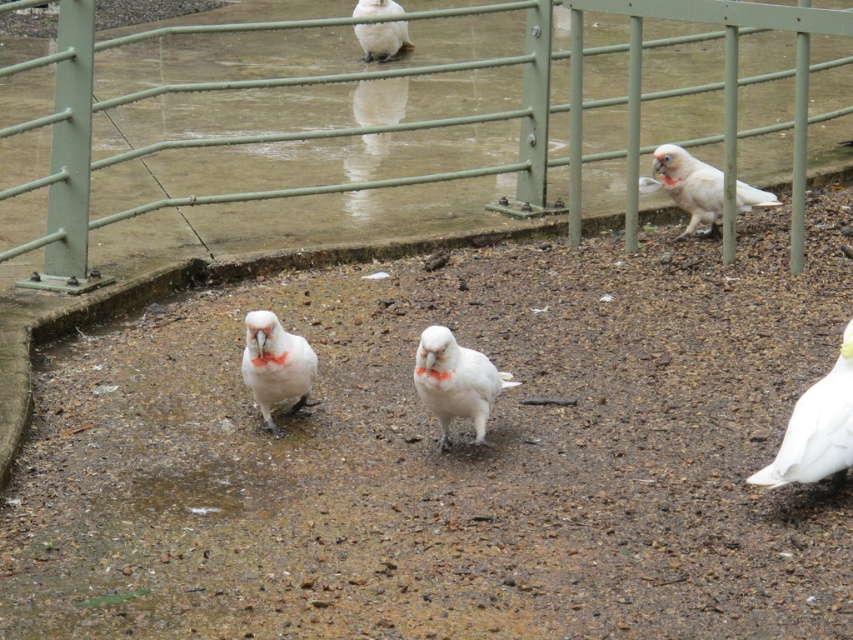
Can you confirm if white matte parrot at center is taller than white feathered parrot at center?

Incorrect, white matte parrot at center's height is not larger of white feathered parrot at center's.

Does white matte parrot at center have a lesser width compared to white feathered parrot at center?

No.

What do you see at coordinates (456, 381) in the screenshot? The width and height of the screenshot is (853, 640). I see `white matte parrot at center` at bounding box center [456, 381].

Locate an element on the screen. white matte parrot at center is located at coordinates tap(456, 381).

Is point (840, 433) closer to viewer compared to point (270, 330)?

That is True.

Does white feathered parrot at lower right appear under white feathered parrot at center?

Correct, white feathered parrot at lower right is located below white feathered parrot at center.

Locate an element on the screen. Image resolution: width=853 pixels, height=640 pixels. white feathered parrot at lower right is located at coordinates (816, 428).

Which of these two, green metal fence at upper center or white feathered bird at upper center, stands shorter?

Standing shorter between the two is white feathered bird at upper center.

Is point (611, 48) behind point (392, 54)?

No, it is in front of (392, 54).

Where is `green metal fence at upper center`? green metal fence at upper center is located at coordinates [x=410, y=122].